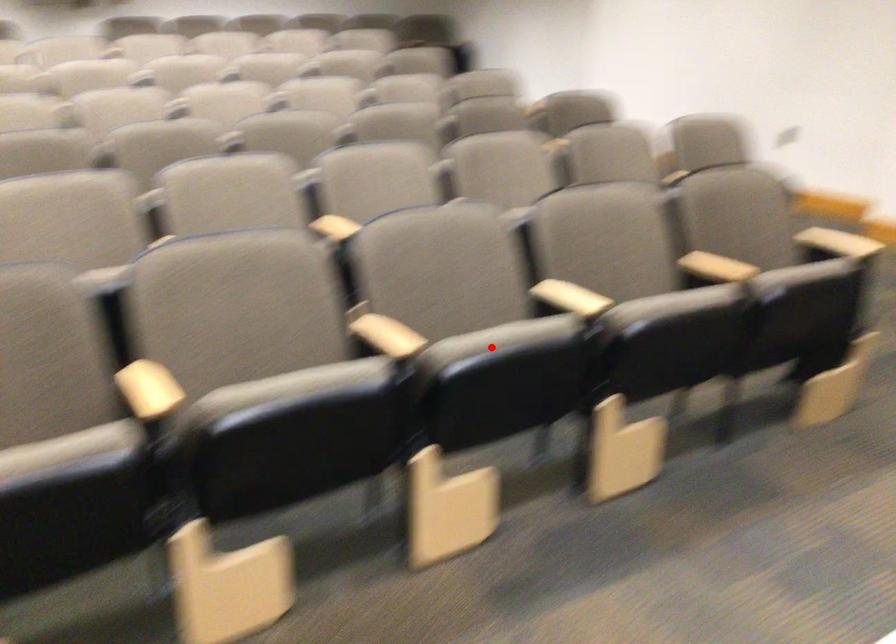
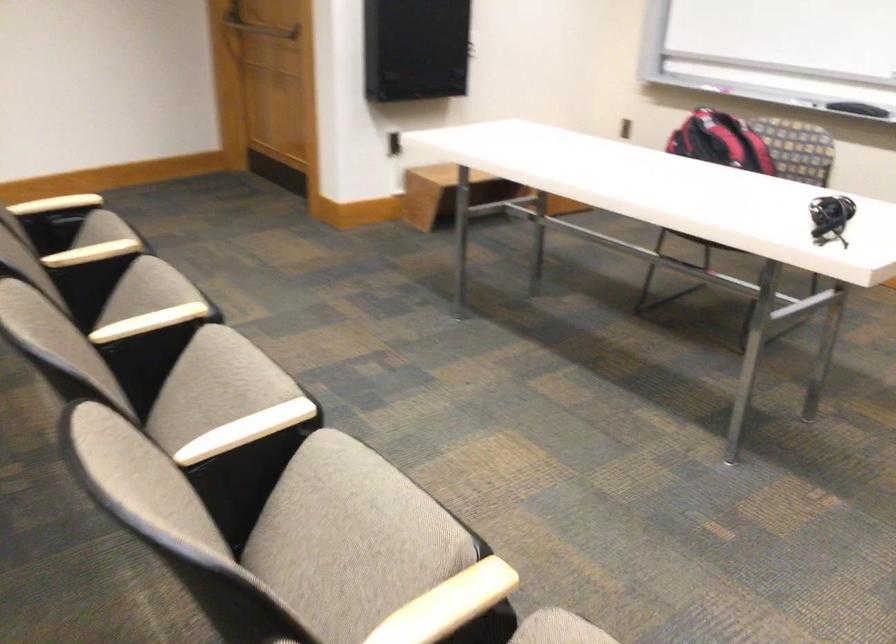
Where in the second image is the point corresponding to the highlighted location from the first image?

(214, 386)